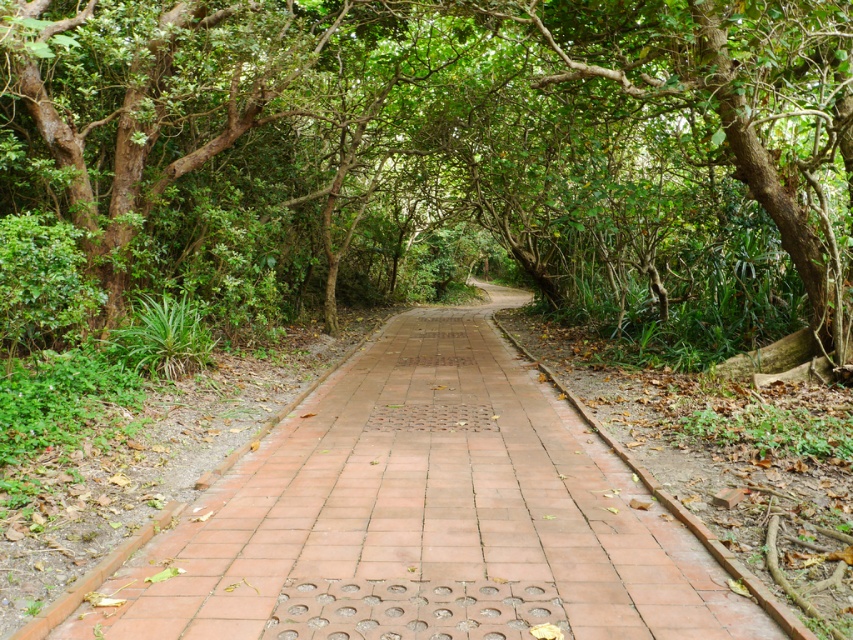
Question: Can you confirm if green leafy tree at center is positioned to the right of terracotta brick pavement at center?

Choices:
 (A) yes
 (B) no

Answer: (B)

Question: Which of the following is the closest to the observer?

Choices:
 (A) terracotta brick pavement at center
 (B) green leafy tree at center

Answer: (A)

Question: Does green leafy tree at center appear on the left side of terracotta brick pavement at center?

Choices:
 (A) yes
 (B) no

Answer: (A)

Question: Is green leafy tree at center to the left of terracotta brick pavement at center from the viewer's perspective?

Choices:
 (A) yes
 (B) no

Answer: (A)

Question: Which object appears closest to the camera in this image?

Choices:
 (A) green leafy tree at center
 (B) terracotta brick pavement at center

Answer: (B)